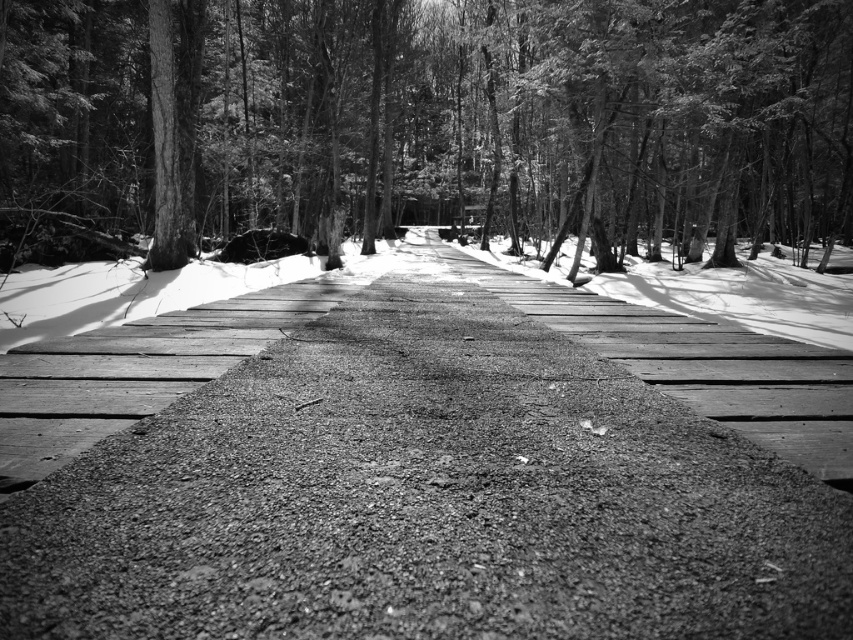
Question: Does dull asphalt road at center have a larger size compared to gravelly asphalt path at center?

Choices:
 (A) no
 (B) yes

Answer: (A)

Question: Which is farther from the dull asphalt road at center?

Choices:
 (A) smooth bark tree at center
 (B) gravelly asphalt path at center

Answer: (A)

Question: Is dull asphalt road at center thinner than smooth bark tree at center?

Choices:
 (A) yes
 (B) no

Answer: (A)

Question: Which of the following is the closest to the observer?

Choices:
 (A) pyautogui.click(x=332, y=328)
 (B) pyautogui.click(x=538, y=20)

Answer: (A)

Question: Can you confirm if smooth bark tree at center is smaller than gravelly asphalt path at center?

Choices:
 (A) no
 (B) yes

Answer: (A)

Question: Based on their relative distances, which object is farther from the smooth bark tree at center?

Choices:
 (A) gravelly asphalt path at center
 (B) dull asphalt road at center

Answer: (B)